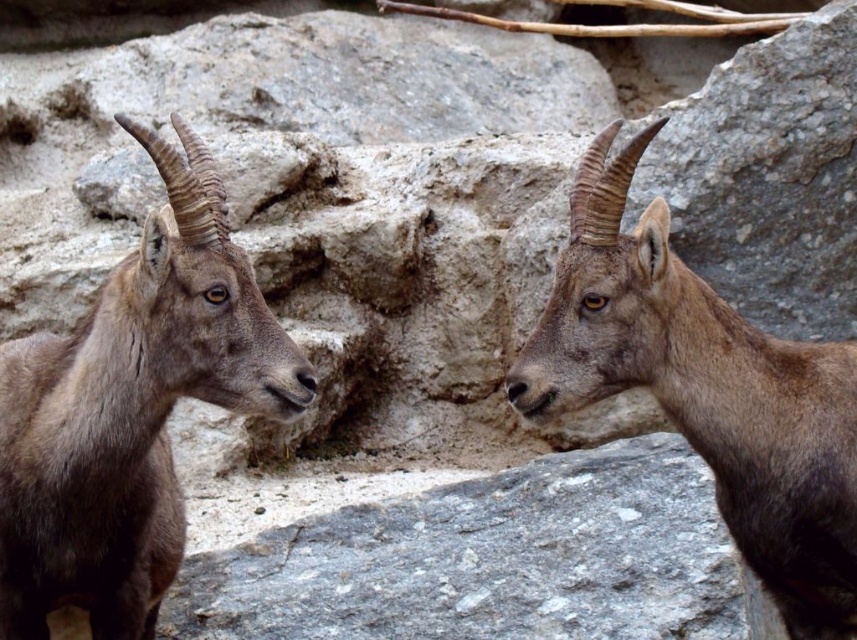
You are standing at the origin point in the image. There is a brown woolen goat at left marked by point (130, 410). What is the direction of the brown woolen goat at left relative to your position?

The brown woolen goat at left is located to the left side of the origin point, so the direction is to the left.

You are a wildlife photographer trying to capture both the brown woolen goat at left and the brown woolen goat at center in a single frame. Based on their positions, which goat would require you to adjust your camera angle more to include both in the shot?

The brown woolen goat at left might require more adjustment since it is wider than the brown woolen goat at center, potentially taking up more space in the frame.